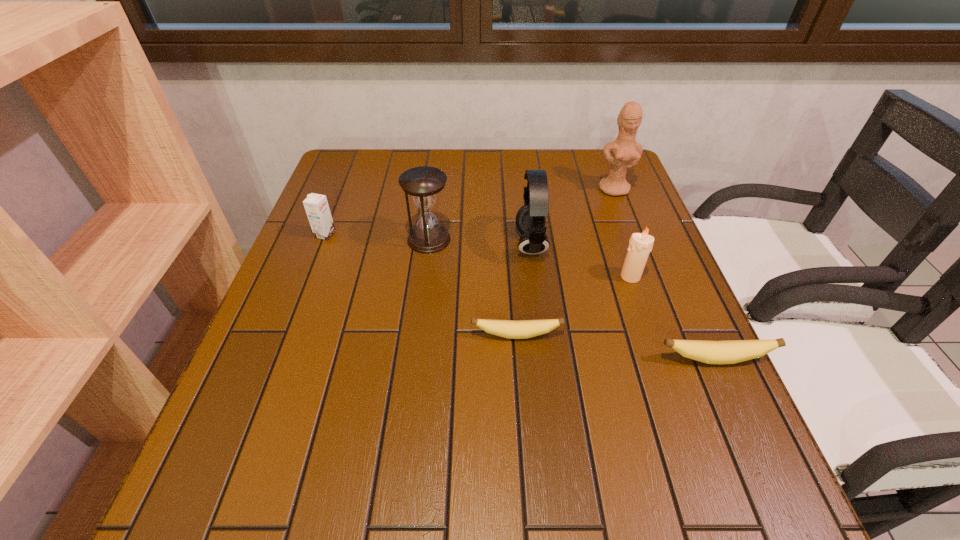
This screenshot has height=540, width=960. What are the coordinates of `vacant region between the right banana and the earphone` in the screenshot? It's located at (623, 302).

I want to click on free area in between the taller banana and the sixth object from right to left, so 572,299.

The width and height of the screenshot is (960, 540). I want to click on vacant area between the shortest object and the taller banana, so [615, 347].

I want to click on the fourth closest object to the leftmost object, so click(x=640, y=244).

Locate an element on the screen. object that is the fifth closest one to the earphone is located at coordinates (732, 351).

Locate an element on the screen. The height and width of the screenshot is (540, 960). free location that satisfies the following two spatial constraints: 1. on the ear cups of the earphone; 2. on the right side of the right banana is located at coordinates (545, 359).

Locate an element on the screen. The image size is (960, 540). free spot that satisfies the following two spatial constraints: 1. on the front-facing side of the figurine; 2. on the ear cups of the earphone is located at coordinates (636, 244).

Where is `blank space that satisfies the following two spatial constraints: 1. on the front-facing side of the figurine; 2. on the ear cups of the earphone`? blank space that satisfies the following two spatial constraints: 1. on the front-facing side of the figurine; 2. on the ear cups of the earphone is located at coordinates (636, 244).

In order to click on vacant space that satisfies the following two spatial constraints: 1. on the front-facing side of the figurine; 2. on the ear cups of the earphone in this screenshot , I will do `click(636, 244)`.

Find the location of `free spot that satisfies the following two spatial constraints: 1. on the front side of the shorter banana; 2. on the left side of the nearest object`. free spot that satisfies the following two spatial constraints: 1. on the front side of the shorter banana; 2. on the left side of the nearest object is located at coordinates (518, 359).